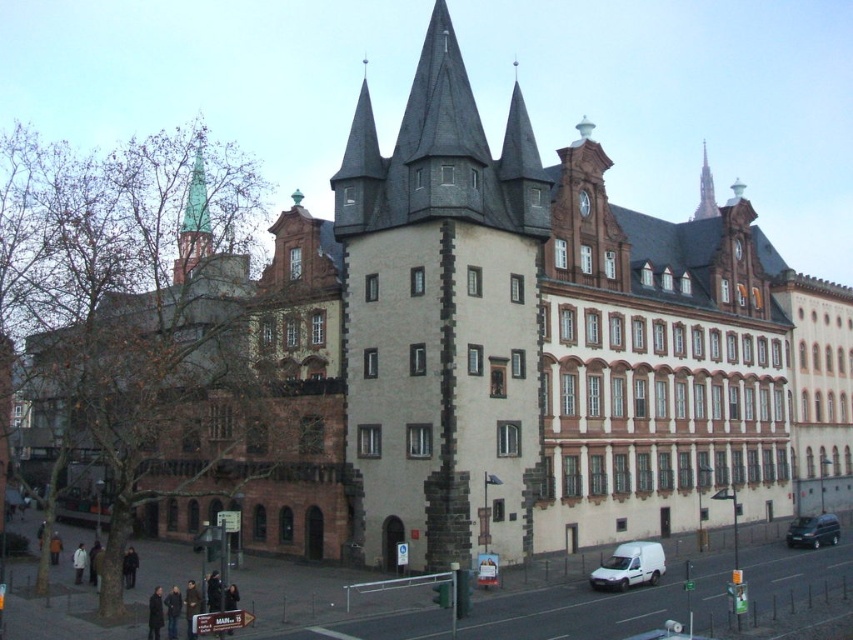
Question: Which of these objects is positioned farthest from the white matte van at lower right?

Choices:
 (A) green glass tower at upper left
 (B) white stone tower at center
 (C) metallic clock at upper center

Answer: (A)

Question: Which point appears closest to the camera in this image?

Choices:
 (A) (585, 198)
 (B) (653, 556)

Answer: (B)

Question: Is white stone tower at center thinner than metallic clock at upper center?

Choices:
 (A) no
 (B) yes

Answer: (A)

Question: Is the position of green glass tower at upper left more distant than that of metallic clock at upper center?

Choices:
 (A) yes
 (B) no

Answer: (B)

Question: Does white matte van at lower right have a greater width compared to dark green matte van at lower right?

Choices:
 (A) yes
 (B) no

Answer: (B)

Question: Which of the following is the farthest from the observer?

Choices:
 (A) (201, 253)
 (B) (694, 212)
 (C) (646, 545)
 (D) (796, 544)

Answer: (B)